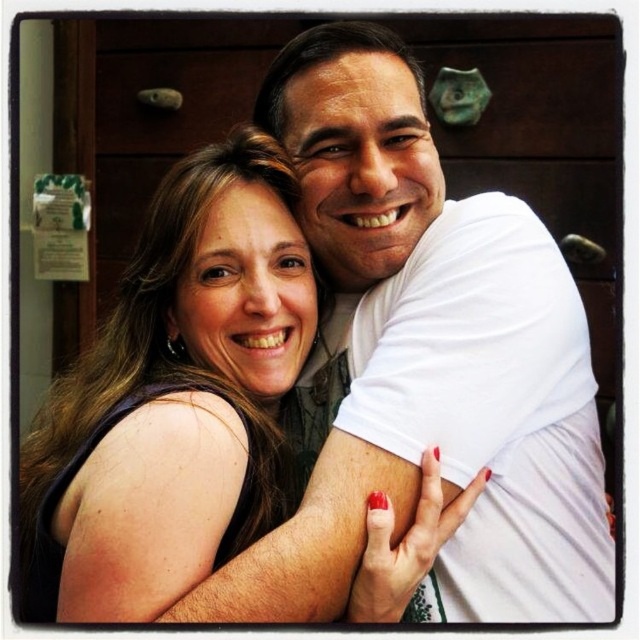
Who is more distant from viewer, (456, 396) or (266, 520)?

The point (266, 520) is behind.

Is white cotton t-shirt at upper right to the left of matte black dress at center from the viewer's perspective?

Incorrect, white cotton t-shirt at upper right is not on the left side of matte black dress at center.

Is point (465, 308) positioned after point (257, 131)?

No, it is not.

Locate an element on the screen. This screenshot has width=640, height=640. white cotton t-shirt at upper right is located at coordinates (449, 330).